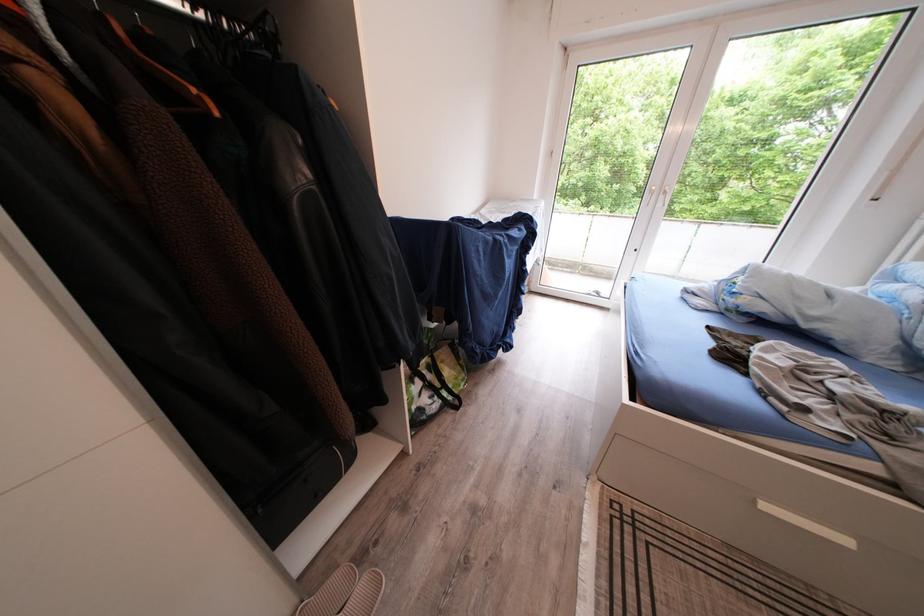
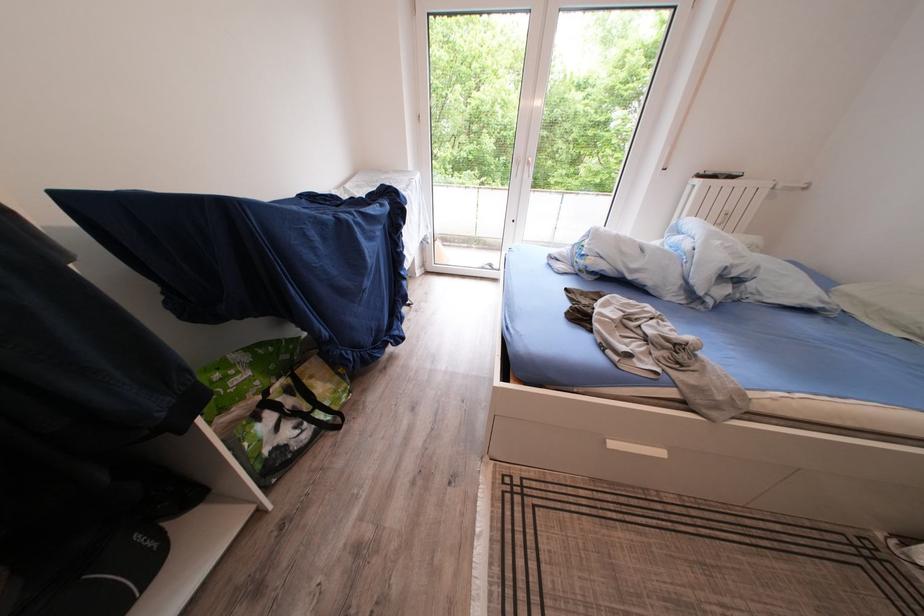
What movement of the cameraman would produce the second image?

The movement direction of the cameraman is right, forward.